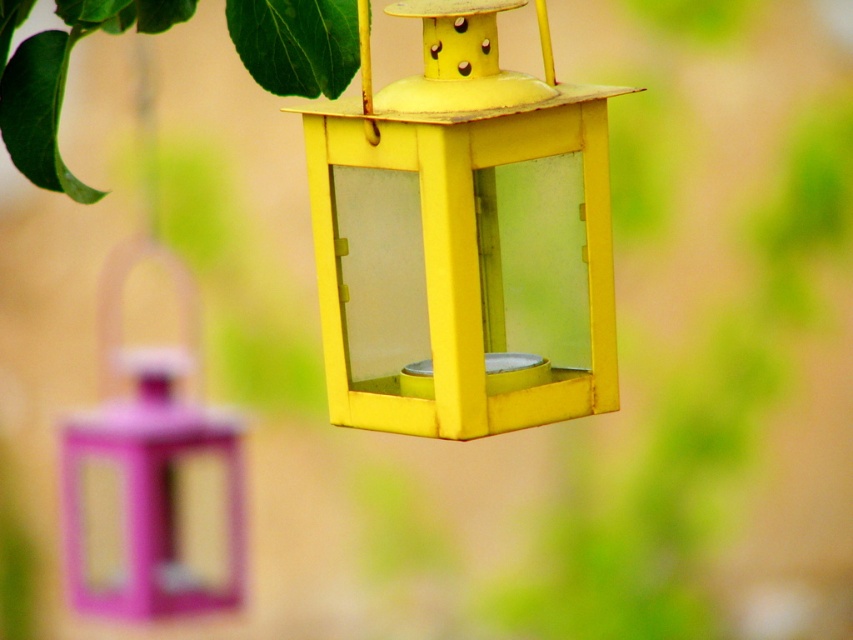
Question: Which is farther from the purple matte bird feeder at left?

Choices:
 (A) green matte leaf at upper left
 (B) yellow matte lantern at center

Answer: (B)

Question: Which point appears closest to the camera in this image?

Choices:
 (A) (115, 467)
 (B) (257, 4)
 (C) (553, 200)

Answer: (C)

Question: Is yellow matte lantern at center positioned at the back of green matte leaf at upper left?

Choices:
 (A) yes
 (B) no

Answer: (B)

Question: Observing the image, what is the correct spatial positioning of purple matte bird feeder at left in reference to green matte leaf at upper left?

Choices:
 (A) below
 (B) above

Answer: (A)

Question: Which point is farther to the camera?

Choices:
 (A) (39, 145)
 (B) (96, 440)

Answer: (B)

Question: Is purple matte bird feeder at left to the left of green matte leaf at upper left from the viewer's perspective?

Choices:
 (A) yes
 (B) no

Answer: (A)